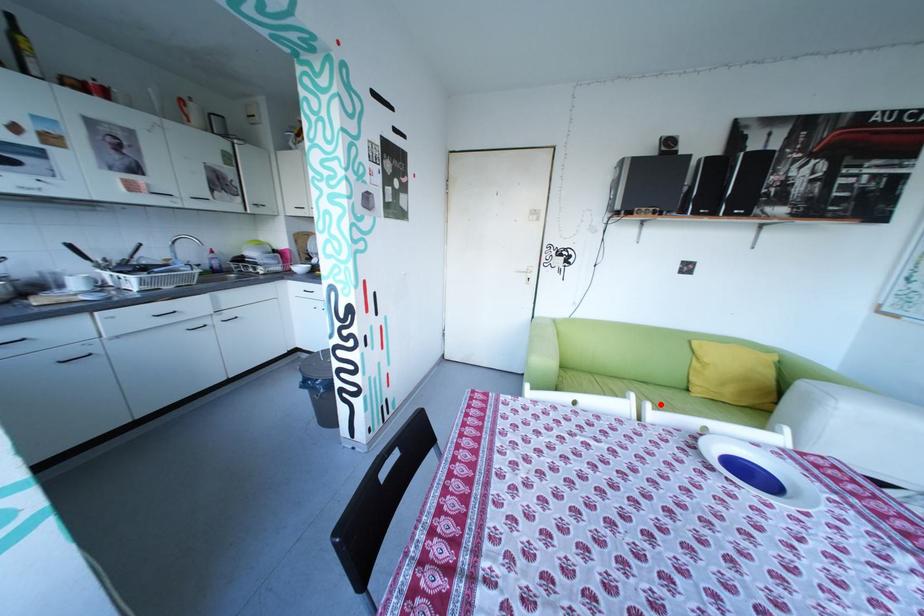
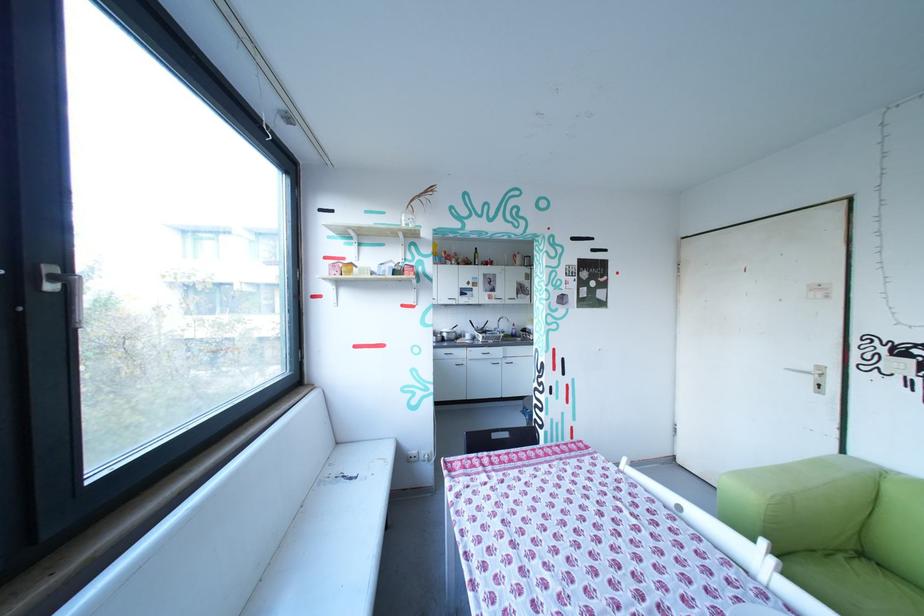
In the second image, find the point that corresponds to the highlighted location in the first image.

(785, 562)